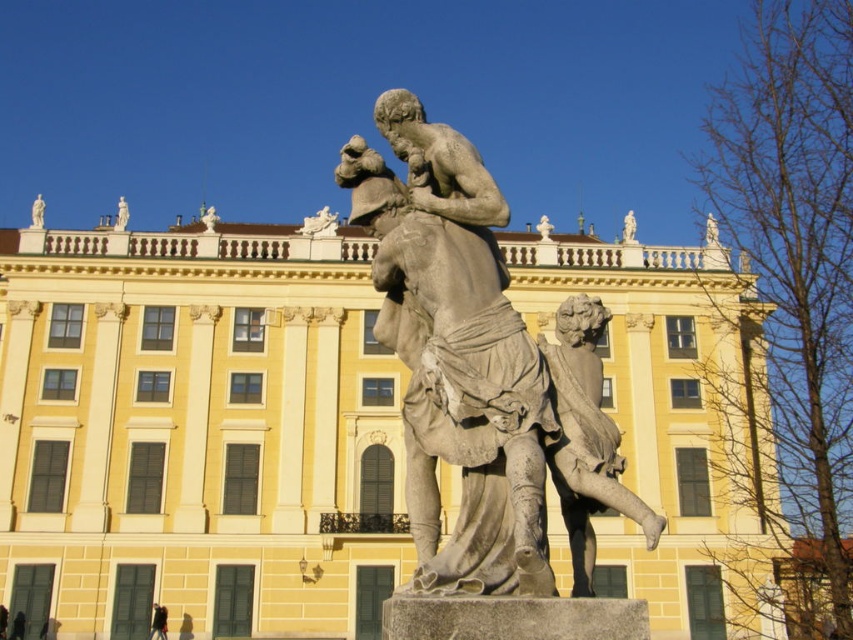
Does yellow stone building at center have a lesser width compared to gray stone statue at center?

No, yellow stone building at center is not thinner than gray stone statue at center.

Does yellow stone building at center appear on the right side of gray stone statue at center?

No, yellow stone building at center is not to the right of gray stone statue at center.

Who is more forward, (51, 444) or (624, 502)?

Point (624, 502)

What are the coordinates of `yellow stone building at center` in the screenshot? It's located at (196, 432).